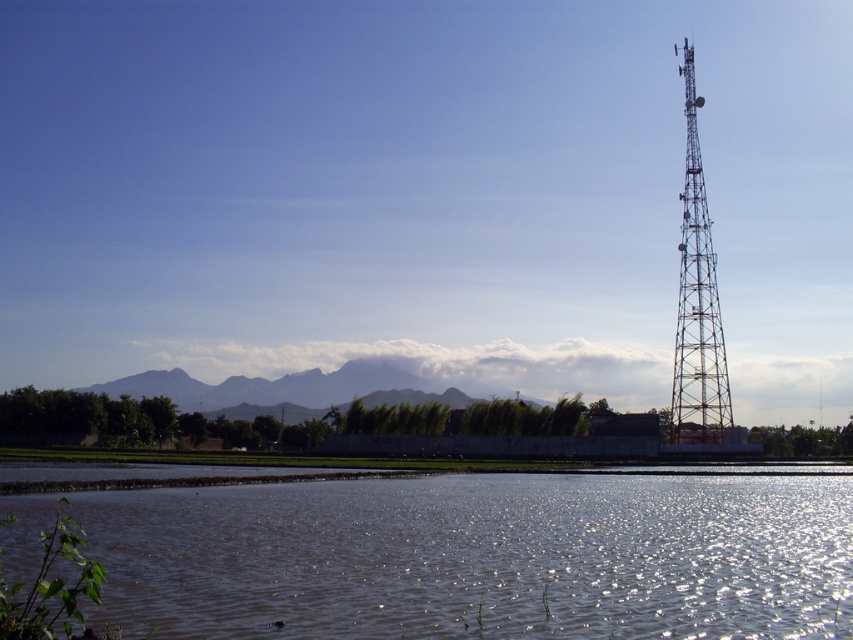
Is point (747, 540) closer to camera compared to point (688, 308)?

Yes, it is in front of point (688, 308).

How much distance is there between clear water at lower center and metallic tower at right?

clear water at lower center and metallic tower at right are 104.13 meters apart from each other.

You are a GUI agent. You are given a task and a screenshot of the screen. Output one action in this format:
    pyautogui.click(x=<x>, y=<y>)
    Task: Click on the clear water at lower center
    The height and width of the screenshot is (640, 853).
    Given the screenshot: What is the action you would take?
    pyautogui.click(x=479, y=556)

I want to click on clear water at lower center, so click(479, 556).